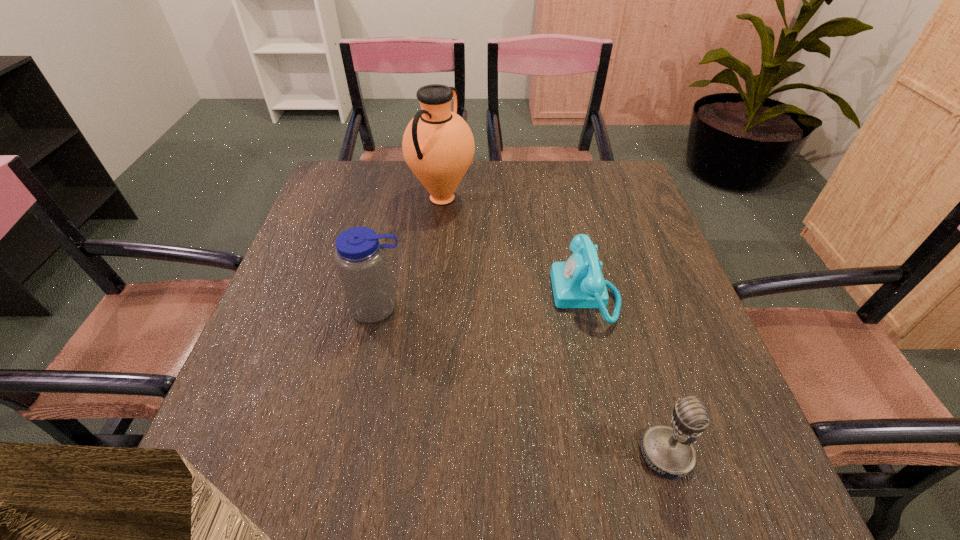
Where is `pitcher`? pitcher is located at coordinates (438, 145).

At what (x,y) coordinates should I click in order to perform the action: click on the tallest object. Please return your answer as a coordinate pair (x, y). The image size is (960, 540). Looking at the image, I should click on (438, 145).

Where is `water bottle`? The width and height of the screenshot is (960, 540). water bottle is located at coordinates (361, 261).

Find the location of a particular element. microphone is located at coordinates (668, 451).

Identify the location of the third tallest object. click(x=668, y=451).

At what (x,y) coordinates should I click in order to perform the action: click on the shortest object. Please return your answer as a coordinate pair (x, y). Looking at the image, I should click on (577, 283).

Image resolution: width=960 pixels, height=540 pixels. Find the location of `free space located on the right of the tallest object`. free space located on the right of the tallest object is located at coordinates (552, 198).

This screenshot has width=960, height=540. Identify the location of blank area located 0.340m with a carrying loop on the side of the third shortest object. (339, 495).

You are a GUI agent. You are given a task and a screenshot of the screen. Output one action in this format:
    pyautogui.click(x=<x>, y=<y>)
    Task: Click on the free space located 0.220m on the front-facing side of the microphone
    
    Given the screenshot: What is the action you would take?
    coord(508,454)

Find the location of a particular element. free space located 0.300m on the front-facing side of the microphone is located at coordinates (460, 454).